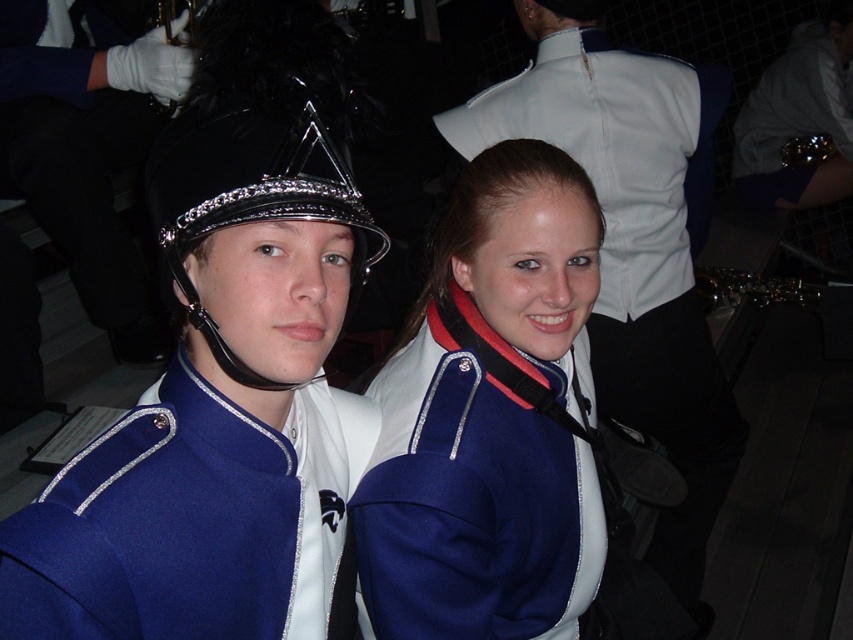
In the scene with the two people in marching band uniforms, where is the blue woolen jacket at center located relative to the shiny black helmet at center?

The blue woolen jacket at center is positioned on the right side of the shiny black helmet at center.

You are a photographer trying to capture a closeup of the blue woolen jacket at center. Based on its 2D coordinates, where should you position your camera relative to the image frame?

The blue woolen jacket at center is located at the 2D coordinates point (488, 420), which means the camera should be positioned slightly to the right and middle of the image frame to capture it in focus.